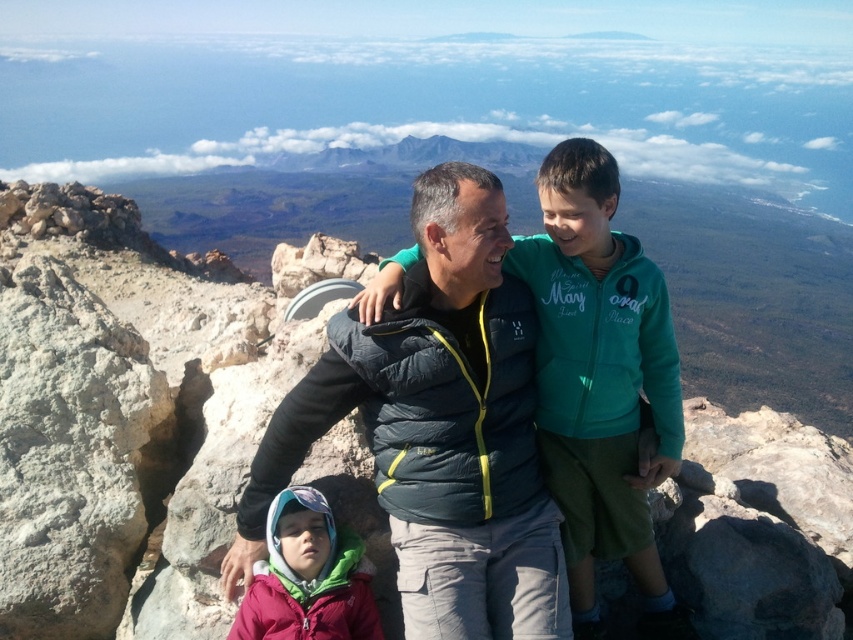
Question: Is dark blue down jacket at center positioned at the back of teal fleece jacket at center?

Choices:
 (A) no
 (B) yes

Answer: (A)

Question: Among these objects, which one is nearest to the camera?

Choices:
 (A) teal fleece jacket at center
 (B) matte pink jacket at lower left
 (C) dark blue down jacket at center

Answer: (B)

Question: Which of the following is the closest to the observer?

Choices:
 (A) (286, 604)
 (B) (566, 182)
 (C) (497, 560)

Answer: (A)

Question: From the image, what is the correct spatial relationship of teal fleece jacket at center in relation to matte pink jacket at lower left?

Choices:
 (A) below
 (B) above

Answer: (B)

Question: Which of the following is the farthest from the observer?

Choices:
 (A) teal fleece jacket at center
 (B) dark blue down jacket at center
 (C) matte pink jacket at lower left

Answer: (A)

Question: Where is dark blue down jacket at center located in relation to matte pink jacket at lower left in the image?

Choices:
 (A) above
 (B) below

Answer: (A)